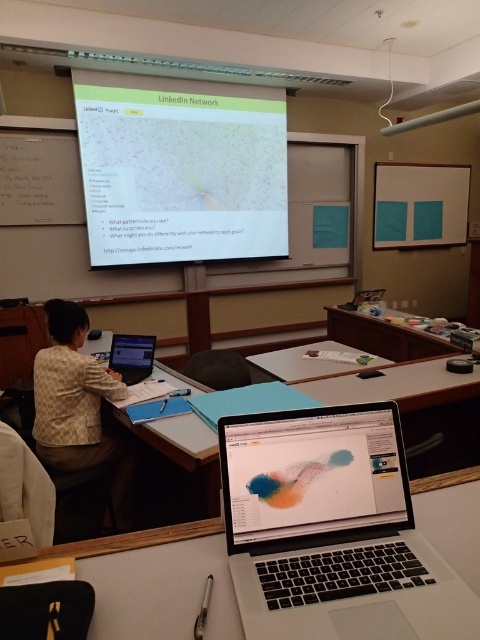
Can you confirm if wooden table at center is positioned to the left of white plastic table at center?

Incorrect, wooden table at center is not on the left side of white plastic table at center.

This screenshot has height=640, width=480. In order to click on wooden table at center in this screenshot , I will do point(383,337).

Where is `wooden table at center`? The width and height of the screenshot is (480, 640). wooden table at center is located at coordinates (383, 337).

Locate an element on the screen. This screenshot has width=480, height=640. yellow patterned shirt at left is located at coordinates (79, 406).

Who is lower down, yellow patterned shirt at left or white plastic table at center?

yellow patterned shirt at left

This screenshot has height=640, width=480. What do you see at coordinates (79, 406) in the screenshot?
I see `yellow patterned shirt at left` at bounding box center [79, 406].

This screenshot has width=480, height=640. In order to click on yellow patterned shirt at left in this screenshot , I will do `click(79, 406)`.

Does white matte projector screen at upper center have a smaller size compared to wooden table at center?

No.

Is white matte projector screen at upper center positioned in front of wooden table at center?

No, it is not.

This screenshot has height=640, width=480. Find the location of `white matte projector screen at upper center`. white matte projector screen at upper center is located at coordinates (180, 170).